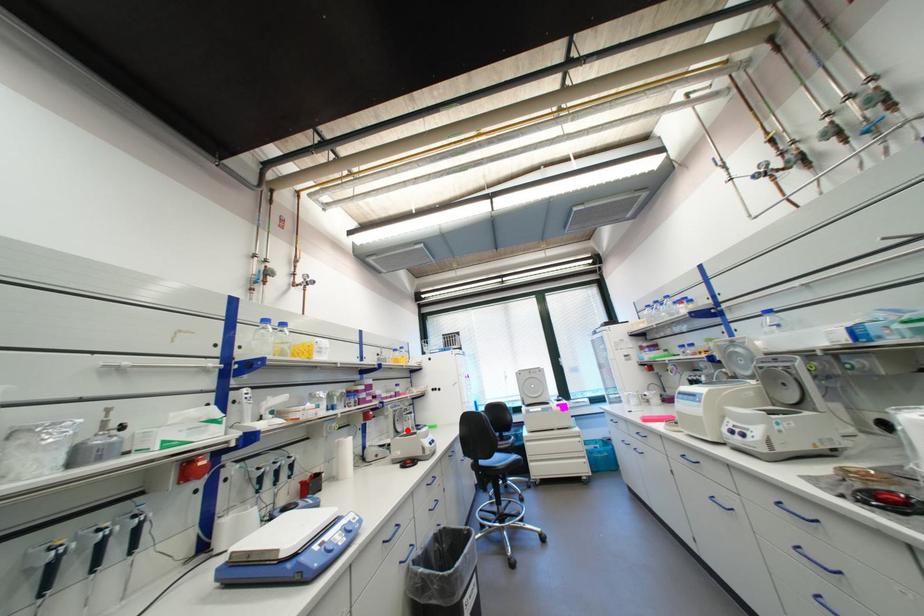
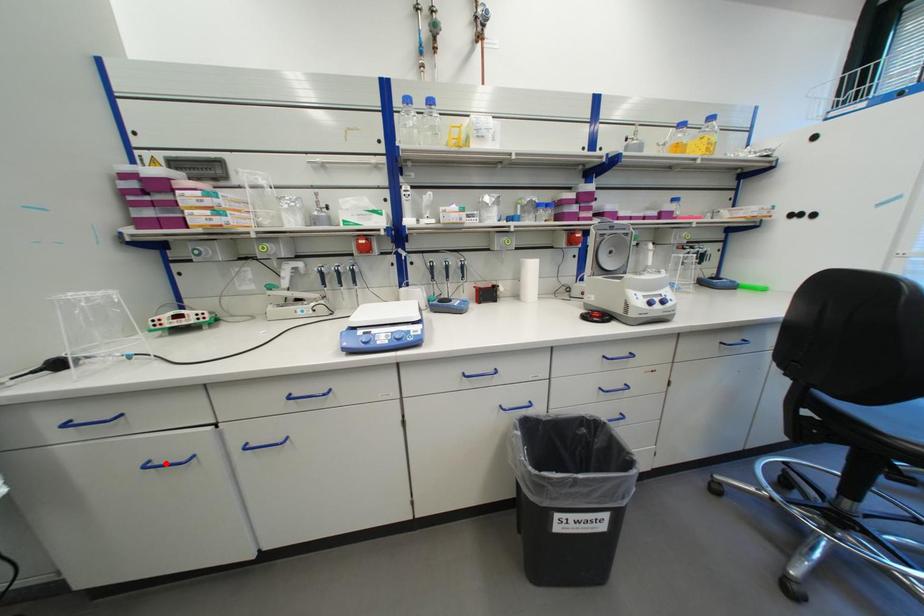
I am providing you with two images of the same scene from different viewpoints. A red point is marked on the first image and another point is marked on the second image. Do the highlighted points in image1 and image2 indicate the same real-world spot?

No